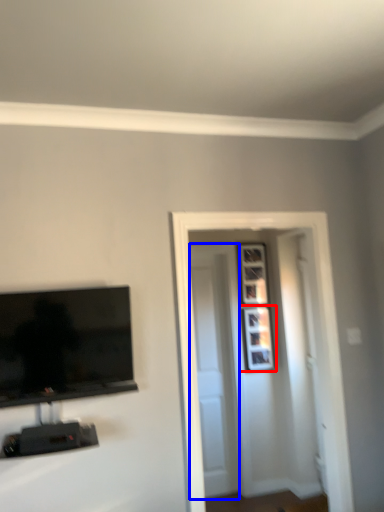
Question: Which object appears farthest to the camera in this image, picture frame (highlighted by a red box) or door (highlighted by a blue box)?

Choices:
 (A) picture frame
 (B) door

Answer: (A)